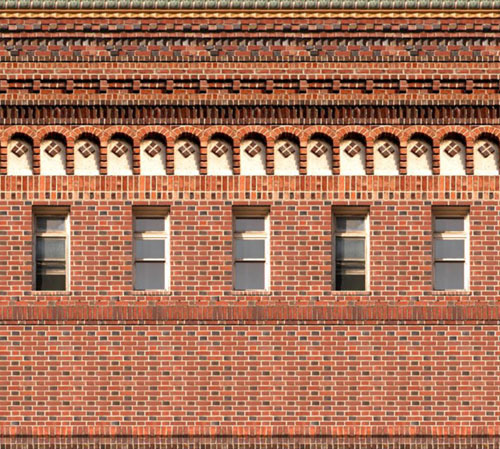
Locate an element on the screen. white trim on windows is located at coordinates (167, 252), (266, 247).